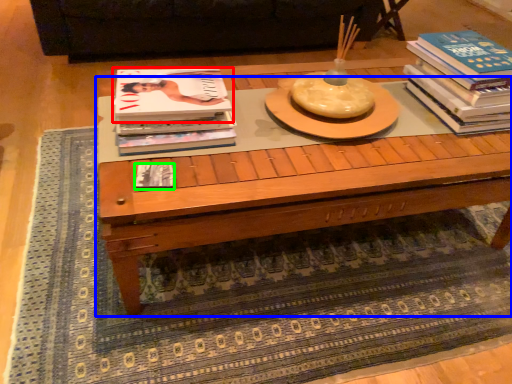
Question: Which object is positioned closest to book (highlighted by a red box)? Select from coffee table (highlighted by a blue box) and book (highlighted by a green box).

Choices:
 (A) coffee table
 (B) book

Answer: (B)